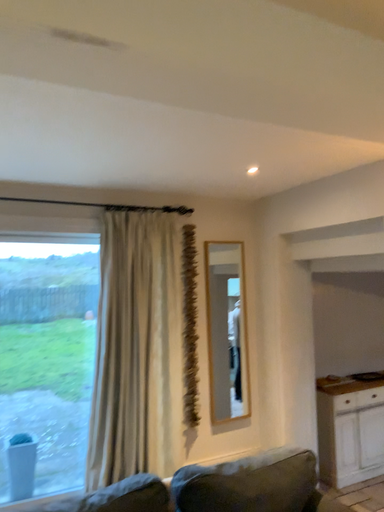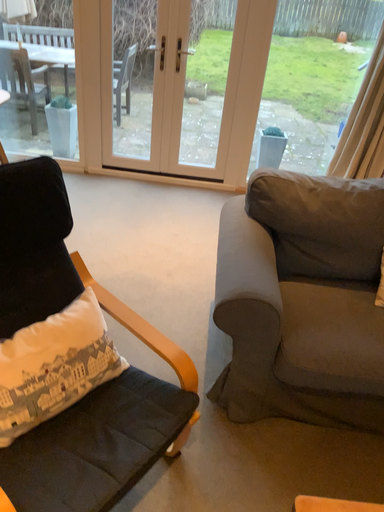
Question: Which way did the camera rotate in the video?

Choices:
 (A) rotated left
 (B) rotated right

Answer: (A)